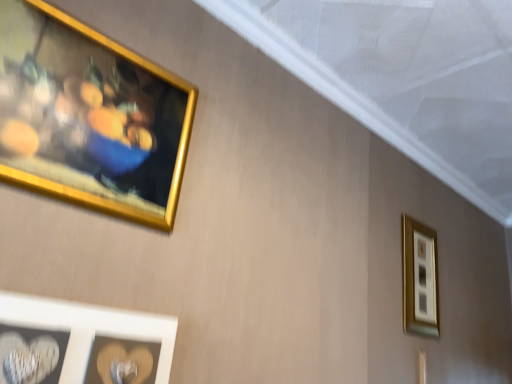
Image resolution: width=512 pixels, height=384 pixels. What do you see at coordinates (81, 343) in the screenshot? I see `white matte heart at lower left, which appears as the second picture frame when viewed from the left` at bounding box center [81, 343].

At what (x,y) coordinates should I click in order to perform the action: click on gold metallic picture frame at upper right, marked as the first picture frame in a right-to-left arrangement. Please return your answer as a coordinate pair (x, y). Image resolution: width=512 pixels, height=384 pixels. Looking at the image, I should click on (419, 278).

The image size is (512, 384). What do you see at coordinates (93, 113) in the screenshot?
I see `gold metallic picture frame at upper left, which is the 1th picture frame from left to right` at bounding box center [93, 113].

Where is `white matte heart at lower left, which is the 2th picture frame from right to left`? white matte heart at lower left, which is the 2th picture frame from right to left is located at coordinates (81, 343).

Considering the positions of objects gold metallic picture frame at upper left, the 3th picture frame from the right, and white matte heart at lower left, the 3th picture frame from the back, in the image provided, who is more to the right, gold metallic picture frame at upper left, the 3th picture frame from the right, or white matte heart at lower left, the 3th picture frame from the back,?

From the viewer's perspective, white matte heart at lower left, the 3th picture frame from the back, appears more on the right side.

Between gold metallic picture frame at upper left, the 3th picture frame from the right, and white matte heart at lower left, which appears as the second picture frame when viewed from the left, which one has more height?

gold metallic picture frame at upper left, the 3th picture frame from the right, is taller.

Does gold metallic picture frame at upper left, which is the second picture frame in front-to-back order, come in front of white matte heart at lower left, which appears as the second picture frame when viewed from the left?

No, gold metallic picture frame at upper left, which is the second picture frame in front-to-back order, is further to the viewer.

From the image's perspective, which object appears higher, gold metallic picture frame at upper left, the 3th picture frame from the right, or white matte heart at lower left, which is the 1th picture frame in front-to-back order?

gold metallic picture frame at upper left, the 3th picture frame from the right.

Is gold metallic picture frame at upper right, the first picture frame in the back-to-front sequence, turned away from white matte heart at lower left, which appears as the second picture frame when viewed from the left?

No, gold metallic picture frame at upper right, the first picture frame in the back-to-front sequence,'s orientation is not away from white matte heart at lower left, which appears as the second picture frame when viewed from the left.

From the image's perspective, is gold metallic picture frame at upper right, the first picture frame in the back-to-front sequence, above or below white matte heart at lower left, which is the 2th picture frame from right to left?

gold metallic picture frame at upper right, the first picture frame in the back-to-front sequence, is below white matte heart at lower left, which is the 2th picture frame from right to left.

From the image's perspective, count 1st picture frames upward from the gold metallic picture frame at upper right, marked as the first picture frame in a right-to-left arrangement, and point to it. Please provide its 2D coordinates.

[(81, 343)]

Considering the relative sizes of gold metallic picture frame at upper right, marked as the first picture frame in a right-to-left arrangement, and white matte heart at lower left, which appears as the second picture frame when viewed from the left, in the image provided, is gold metallic picture frame at upper right, marked as the first picture frame in a right-to-left arrangement, wider than white matte heart at lower left, which appears as the second picture frame when viewed from the left,?

In fact, gold metallic picture frame at upper right, marked as the first picture frame in a right-to-left arrangement, might be narrower than white matte heart at lower left, which appears as the second picture frame when viewed from the left.

Based on the photo, which object is thinner, white matte heart at lower left, which appears as the second picture frame when viewed from the left, or gold metallic picture frame at upper left, placed as the second picture frame when sorted from back to front?

gold metallic picture frame at upper left, placed as the second picture frame when sorted from back to front, is thinner.

Is white matte heart at lower left, the 3th picture frame from the back, in front of or behind gold metallic picture frame at upper left, which is the second picture frame in front-to-back order, in the image?

Clearly, white matte heart at lower left, the 3th picture frame from the back, is in front of gold metallic picture frame at upper left, which is the second picture frame in front-to-back order.

Is white matte heart at lower left, which is the 1th picture frame in front-to-back order, aimed at gold metallic picture frame at upper left, which is the 1th picture frame from left to right?

No, white matte heart at lower left, which is the 1th picture frame in front-to-back order, is not oriented towards gold metallic picture frame at upper left, which is the 1th picture frame from left to right.

Can you confirm if white matte heart at lower left, which is the 1th picture frame in front-to-back order, is positioned to the left of gold metallic picture frame at upper left, the 3th picture frame from the right?

No, white matte heart at lower left, which is the 1th picture frame in front-to-back order, is not to the left of gold metallic picture frame at upper left, the 3th picture frame from the right.

Consider the image. Is white matte heart at lower left, which is the 1th picture frame in front-to-back order, surrounding gold metallic picture frame at upper right, the third picture frame when ordered from front to back?

No, gold metallic picture frame at upper right, the third picture frame when ordered from front to back, is located outside of white matte heart at lower left, which is the 1th picture frame in front-to-back order.

Based on the photo, from the image's perspective, would you say white matte heart at lower left, the 3th picture frame from the back, is shown under gold metallic picture frame at upper right, the third picture frame when ordered from front to back?

No, from the image's perspective, white matte heart at lower left, the 3th picture frame from the back, is not below gold metallic picture frame at upper right, the third picture frame when ordered from front to back.

Does white matte heart at lower left, which is the 2th picture frame from right to left, lie behind gold metallic picture frame at upper right, the first picture frame in the back-to-front sequence?

No, the depth of white matte heart at lower left, which is the 2th picture frame from right to left, is less than that of gold metallic picture frame at upper right, the first picture frame in the back-to-front sequence.

Who is smaller, white matte heart at lower left, which is the 2th picture frame from right to left, or gold metallic picture frame at upper right, the 3th picture frame in the left-to-right sequence?

white matte heart at lower left, which is the 2th picture frame from right to left, is smaller.

Where is `the 2nd picture frame above the gold metallic picture frame at upper right, the 3th picture frame in the left-to-right sequence (from the image's perspective)`? Image resolution: width=512 pixels, height=384 pixels. the 2nd picture frame above the gold metallic picture frame at upper right, the 3th picture frame in the left-to-right sequence (from the image's perspective) is located at coordinates (93, 113).

Is gold metallic picture frame at upper left, which is the second picture frame in front-to-back order, aimed at gold metallic picture frame at upper right, marked as the first picture frame in a right-to-left arrangement?

No, gold metallic picture frame at upper left, which is the second picture frame in front-to-back order, does not turn towards gold metallic picture frame at upper right, marked as the first picture frame in a right-to-left arrangement.

Is gold metallic picture frame at upper left, which is the 1th picture frame from left to right, touching gold metallic picture frame at upper right, the 3th picture frame in the left-to-right sequence?

No, gold metallic picture frame at upper left, which is the 1th picture frame from left to right, is not making contact with gold metallic picture frame at upper right, the 3th picture frame in the left-to-right sequence.

Does gold metallic picture frame at upper left, placed as the second picture frame when sorted from back to front, come in front of gold metallic picture frame at upper right, the 3th picture frame in the left-to-right sequence?

Yes.

Starting from the gold metallic picture frame at upper right, the third picture frame when ordered from front to back, which picture frame is the 1st one in front? Please provide its 2D coordinates.

[(93, 113)]

Considering the sizes of objects gold metallic picture frame at upper right, the 3th picture frame in the left-to-right sequence, and gold metallic picture frame at upper left, the 3th picture frame from the right, in the image provided, who is bigger, gold metallic picture frame at upper right, the 3th picture frame in the left-to-right sequence, or gold metallic picture frame at upper left, the 3th picture frame from the right,?

gold metallic picture frame at upper left, the 3th picture frame from the right.

In terms of height, does gold metallic picture frame at upper right, the third picture frame when ordered from front to back, look taller or shorter compared to gold metallic picture frame at upper left, which is the second picture frame in front-to-back order?

Considering their sizes, gold metallic picture frame at upper right, the third picture frame when ordered from front to back, has more height than gold metallic picture frame at upper left, which is the second picture frame in front-to-back order.

Locate an element on the screen. The width and height of the screenshot is (512, 384). the 2nd picture frame directly beneath the gold metallic picture frame at upper left, placed as the second picture frame when sorted from back to front (from a real-world perspective) is located at coordinates (81, 343).

From a real-world perspective, starting from the white matte heart at lower left, which is the 1th picture frame in front-to-back order, which picture frame is the 1st one vertically above it? Please provide its 2D coordinates.

[(419, 278)]

From the image, which object appears to be nearer to gold metallic picture frame at upper right, marked as the first picture frame in a right-to-left arrangement, gold metallic picture frame at upper left, which is the second picture frame in front-to-back order, or white matte heart at lower left, the 3th picture frame from the back?

white matte heart at lower left, the 3th picture frame from the back.

Based on the photo, considering their positions, is white matte heart at lower left, which is the 2th picture frame from right to left, positioned closer to gold metallic picture frame at upper left, which is the 1th picture frame from left to right, than gold metallic picture frame at upper right, the 3th picture frame in the left-to-right sequence?

white matte heart at lower left, which is the 2th picture frame from right to left.

Estimate the real-world distances between objects in this image. Which object is further from white matte heart at lower left, which appears as the second picture frame when viewed from the left, gold metallic picture frame at upper right, the 3th picture frame in the left-to-right sequence, or gold metallic picture frame at upper left, the 3th picture frame from the right?

gold metallic picture frame at upper right, the 3th picture frame in the left-to-right sequence, is further to white matte heart at lower left, which appears as the second picture frame when viewed from the left.

From the image, which object appears to be farther from gold metallic picture frame at upper left, placed as the second picture frame when sorted from back to front, gold metallic picture frame at upper right, marked as the first picture frame in a right-to-left arrangement, or white matte heart at lower left, which is the 1th picture frame in front-to-back order?

gold metallic picture frame at upper right, marked as the first picture frame in a right-to-left arrangement, is further to gold metallic picture frame at upper left, placed as the second picture frame when sorted from back to front.

Considering their positions, is white matte heart at lower left, which appears as the second picture frame when viewed from the left, positioned closer to gold metallic picture frame at upper right, marked as the first picture frame in a right-to-left arrangement, than gold metallic picture frame at upper left, placed as the second picture frame when sorted from back to front?

white matte heart at lower left, which appears as the second picture frame when viewed from the left.

Based on their spatial positions, is gold metallic picture frame at upper left, which is the second picture frame in front-to-back order, or gold metallic picture frame at upper right, the third picture frame when ordered from front to back, closer to white matte heart at lower left, which appears as the second picture frame when viewed from the left?

gold metallic picture frame at upper left, which is the second picture frame in front-to-back order, is closer to white matte heart at lower left, which appears as the second picture frame when viewed from the left.

The width and height of the screenshot is (512, 384). What are the coordinates of `picture frame between gold metallic picture frame at upper left, placed as the second picture frame when sorted from back to front, and gold metallic picture frame at upper right, the third picture frame when ordered from front to back` in the screenshot? It's located at (81, 343).